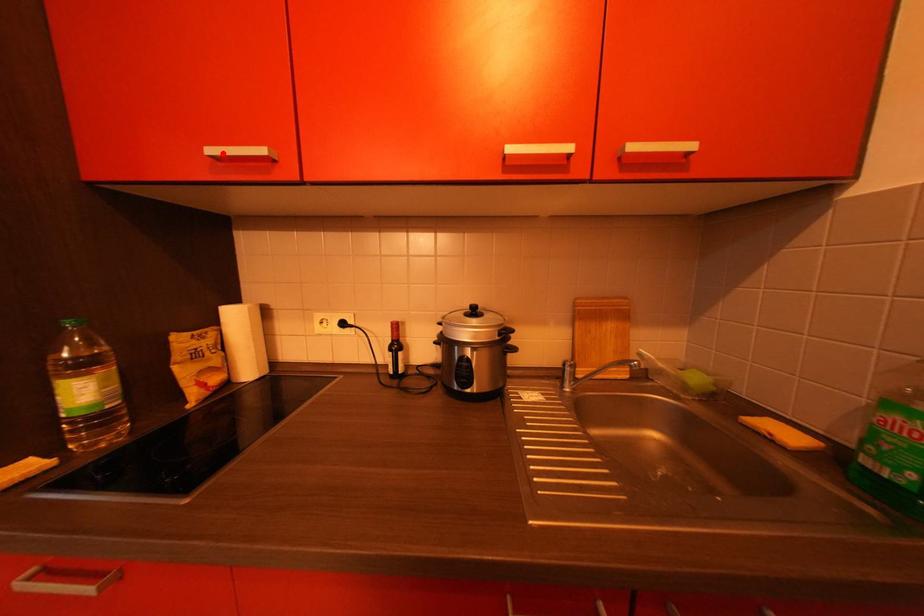
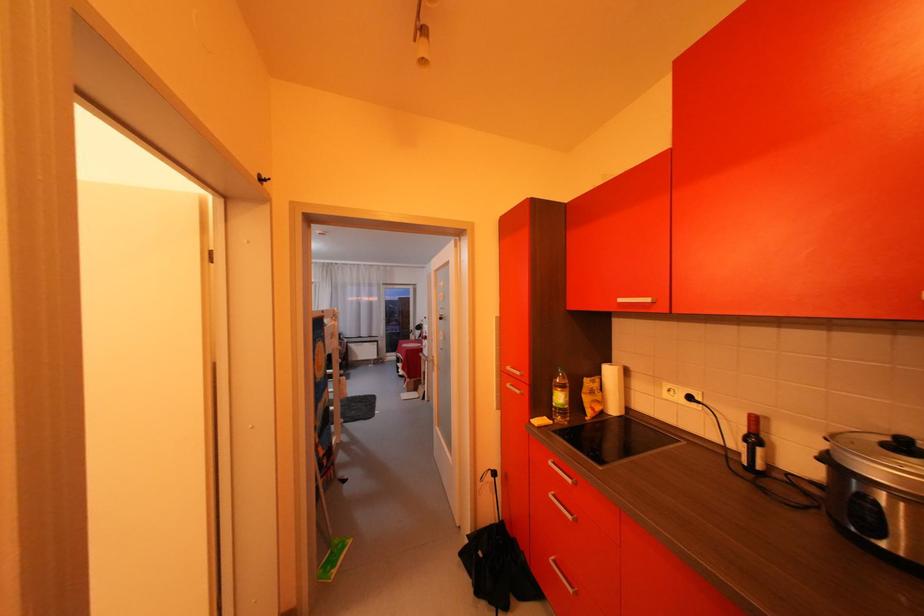
Locate, in the second image, the point that corresponds to the highlighted location in the first image.

(631, 302)